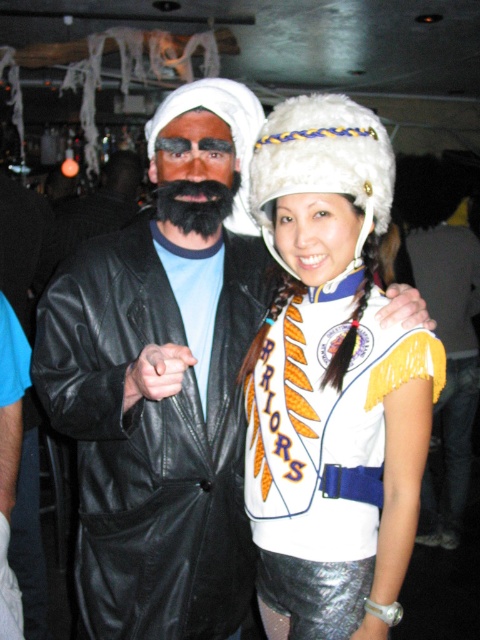
Is point (253, 244) more distant than point (242, 202)?

No, it is in front of (242, 202).

Is black leather coat at left to the right of white fuzzy hat at center from the viewer's perspective?

No, black leather coat at left is not to the right of white fuzzy hat at center.

Is point (187, 404) positioned behind point (189, 83)?

No, (187, 404) is in front of (189, 83).

Locate an element on the screen. This screenshot has width=480, height=640. black leather coat at left is located at coordinates (152, 438).

This screenshot has width=480, height=640. What do you see at coordinates (332, 381) in the screenshot?
I see `white fur hat at upper center` at bounding box center [332, 381].

Is point (349, 180) less distant than point (245, 186)?

Yes, point (349, 180) is closer to viewer.

The height and width of the screenshot is (640, 480). Find the location of `white fur hat at upper center`. white fur hat at upper center is located at coordinates (332, 381).

Is point (207, 77) farther from camera compared to point (168, 182)?

Yes.

Does white fuzzy hat at center have a larger size compared to black fuzzy beard at center?

Correct, white fuzzy hat at center is larger in size than black fuzzy beard at center.

Where is `white fuzzy hat at center`? white fuzzy hat at center is located at coordinates (228, 128).